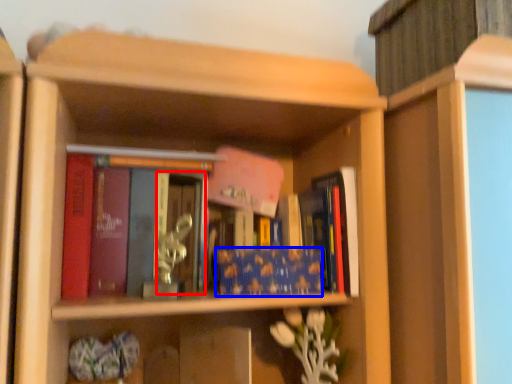
Question: Which of the following is the farthest to the observer, glass door (highlighted by a red box) or book (highlighted by a blue box)?

Choices:
 (A) glass door
 (B) book

Answer: (B)